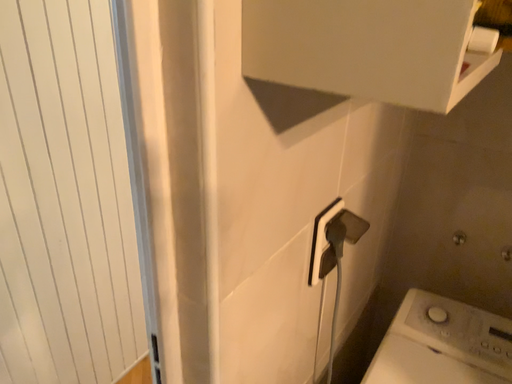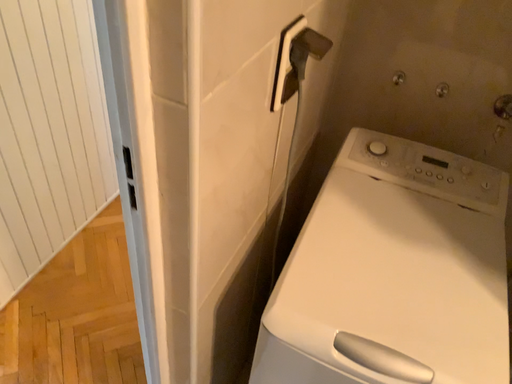
Question: How did the camera likely rotate when shooting the video?

Choices:
 (A) rotated left
 (B) rotated right

Answer: (B)